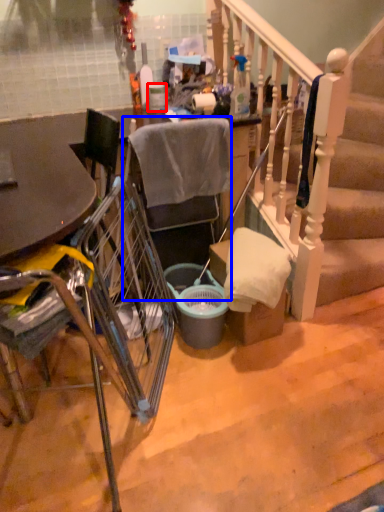
Question: Which object appears closest to the camera in this image, trash bin/can (highlighted by a red box) or chair (highlighted by a blue box)?

Choices:
 (A) trash bin/can
 (B) chair

Answer: (B)